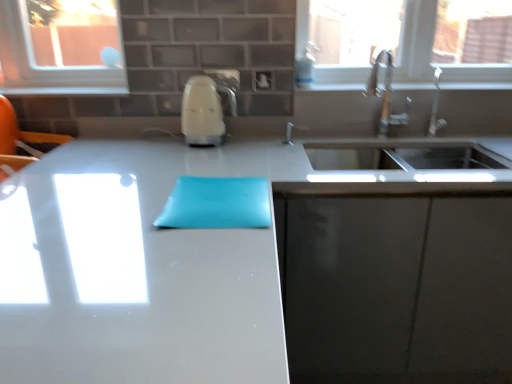
Question: Does transparent glass window at upper right have a lesser width compared to satin nickel faucet at upper right?

Choices:
 (A) no
 (B) yes

Answer: (A)

Question: Is transparent glass window at upper right in front of satin nickel faucet at upper right?

Choices:
 (A) yes
 (B) no

Answer: (B)

Question: From the image's perspective, is transparent glass window at upper right below satin nickel faucet at upper right?

Choices:
 (A) yes
 (B) no

Answer: (B)

Question: Considering the relative sizes of transparent glass window at upper right and satin nickel faucet at upper right in the image provided, is transparent glass window at upper right taller than satin nickel faucet at upper right?

Choices:
 (A) yes
 (B) no

Answer: (A)

Question: Is transparent glass window at upper right positioned behind satin nickel faucet at upper right?

Choices:
 (A) no
 (B) yes

Answer: (B)

Question: From their relative heights in the image, would you say white glossy countertop at center is taller or shorter than transparent glass window at upper right?

Choices:
 (A) tall
 (B) short

Answer: (A)

Question: From the image's perspective, is white glossy countertop at center above or below transparent glass window at upper right?

Choices:
 (A) below
 (B) above

Answer: (A)

Question: Do you think white glossy countertop at center is within transparent glass window at upper right, or outside of it?

Choices:
 (A) outside
 (B) inside

Answer: (A)

Question: Looking at their shapes, would you say white glossy countertop at center is wider or thinner than transparent glass window at upper right?

Choices:
 (A) wide
 (B) thin

Answer: (A)

Question: Is transparent glass window at upper right wider or thinner than white glossy countertop at center?

Choices:
 (A) wide
 (B) thin

Answer: (B)

Question: In the image, is transparent glass window at upper right positioned in front of or behind white glossy countertop at center?

Choices:
 (A) behind
 (B) front

Answer: (A)

Question: Is transparent glass window at upper right to the left or to the right of white glossy countertop at center in the image?

Choices:
 (A) right
 (B) left

Answer: (A)

Question: Does point (366, 23) appear closer or farther from the camera than point (450, 145)?

Choices:
 (A) farther
 (B) closer

Answer: (A)

Question: Does point (352, 84) appear closer or farther from the camera than point (433, 102)?

Choices:
 (A) closer
 (B) farther

Answer: (B)

Question: In terms of height, does white glossy window sill at upper center look taller or shorter compared to satin nickel faucet at upper right?

Choices:
 (A) tall
 (B) short

Answer: (B)